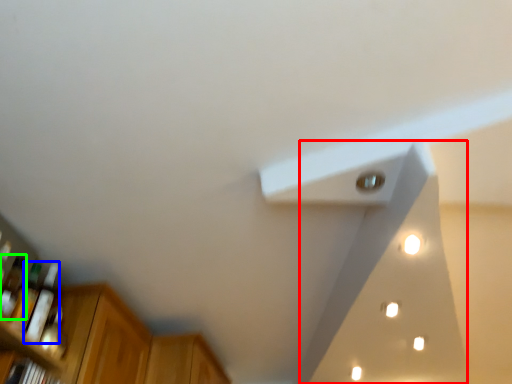
Question: Which object is positioned farthest from exhaust hood (highlighted by a red box)? Select from bottle (highlighted by a blue box) and bottle (highlighted by a green box).

Choices:
 (A) bottle
 (B) bottle

Answer: (B)